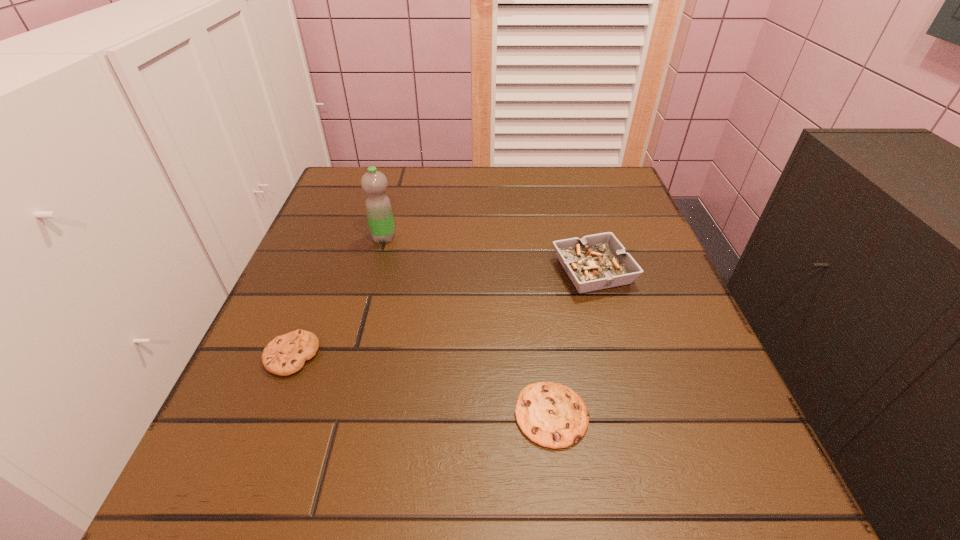
Where is `the farthest object`? The height and width of the screenshot is (540, 960). the farthest object is located at coordinates coord(378,206).

I want to click on water bottle, so click(378, 206).

Find the location of a particular element. the second farthest object is located at coordinates (599, 261).

At what (x,y) coordinates should I click in order to perform the action: click on the second tallest object. Please return your answer as a coordinate pair (x, y). This screenshot has width=960, height=540. Looking at the image, I should click on (599, 261).

You are a GUI agent. You are given a task and a screenshot of the screen. Output one action in this format:
    pyautogui.click(x=<x>, y=<y>)
    Task: Click on the left cookie
    The image size is (960, 540).
    Given the screenshot: What is the action you would take?
    pyautogui.click(x=286, y=354)

Identify the location of the taller cookie. (286, 354).

Locate an element on the screen. The width and height of the screenshot is (960, 540). the nearer cookie is located at coordinates (551, 415).

You are a GUI agent. You are given a task and a screenshot of the screen. Output one action in this format:
    pyautogui.click(x=<x>, y=<y>)
    Task: Click on the shorter cookie
    Image resolution: width=960 pixels, height=540 pixels.
    Given the screenshot: What is the action you would take?
    pyautogui.click(x=551, y=415)

Where is `blank area located 0.190m on the front of the second object from left to right`? The height and width of the screenshot is (540, 960). blank area located 0.190m on the front of the second object from left to right is located at coordinates (365, 309).

Find the location of `blank space located 0.070m on the back of the ashtray`. blank space located 0.070m on the back of the ashtray is located at coordinates (581, 227).